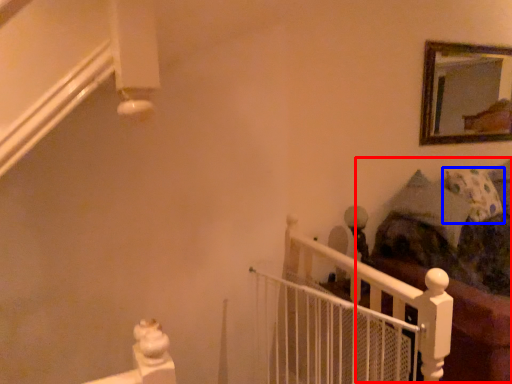
Question: Which object appears farthest to the camera in this image, bed (highlighted by a red box) or pillow (highlighted by a blue box)?

Choices:
 (A) bed
 (B) pillow

Answer: (B)